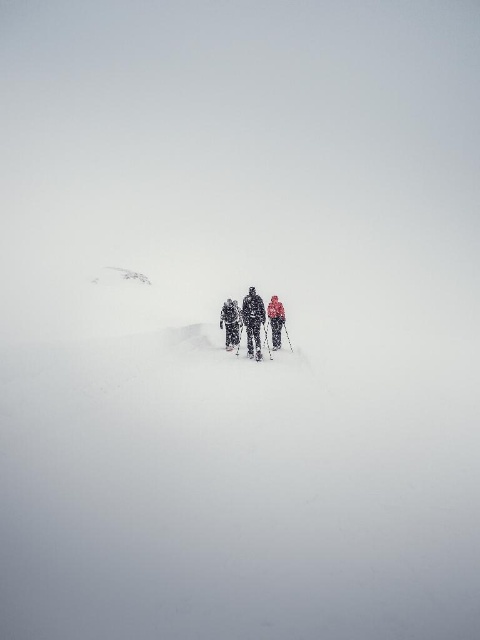
Question: Estimate the real-world distances between objects in this image. Which object is farther from the dark gray ski suit at center?

Choices:
 (A) white powdery snow at center
 (B) red fabric jacket at center

Answer: (A)

Question: Is white powdery snow at center below snow-covered ski suit at center?

Choices:
 (A) no
 (B) yes

Answer: (B)

Question: Does white powdery snow at center appear over snow-covered ski suit at center?

Choices:
 (A) yes
 (B) no

Answer: (B)

Question: Which point is farther to the camera?

Choices:
 (A) snow-covered ski suit at center
 (B) red fabric jacket at center

Answer: (B)

Question: Which point appears closest to the camera in this image?

Choices:
 (A) (278, 317)
 (B) (230, 344)

Answer: (B)

Question: Can you confirm if dark gray ski suit at center is positioned to the left of red fabric jacket at center?

Choices:
 (A) no
 (B) yes

Answer: (B)